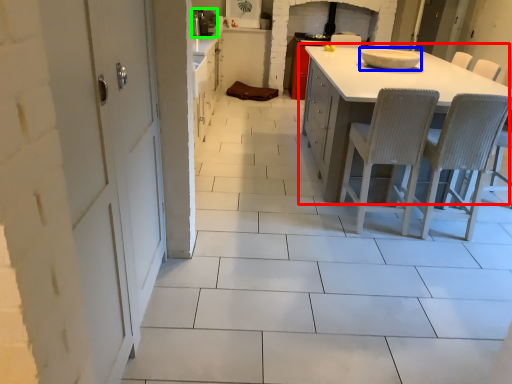
Question: Estimate the real-world distances between objects in this image. Which object is farther from table (highlighted by a red box), appliance (highlighted by a blue box) or appliance (highlighted by a green box)?

Choices:
 (A) appliance
 (B) appliance

Answer: (B)